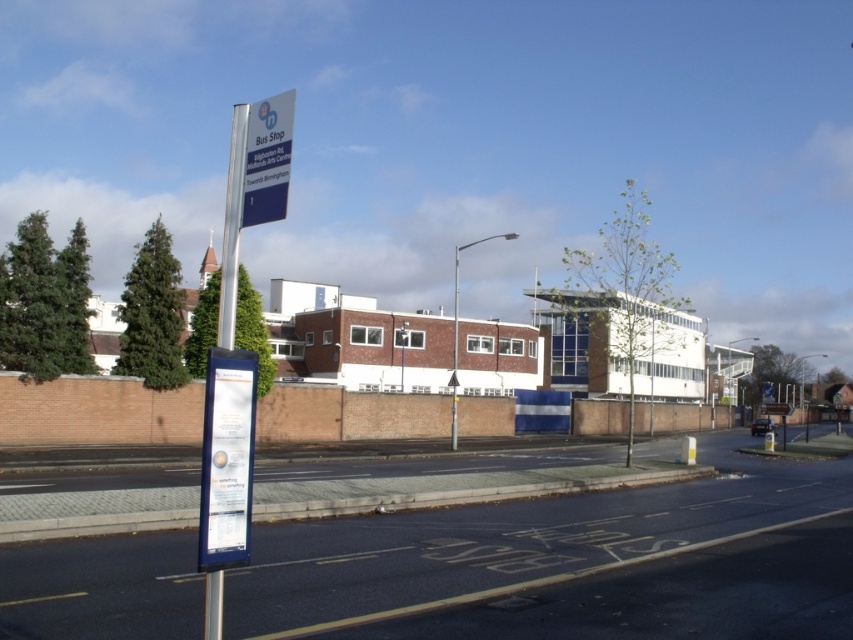
You are waiting at a bus stop and want to check the route details. The blue plastic sign at upper center shows the route number, while the metallic pole at center holds up the sign. Where should you look to see the route number?

The blue plastic sign at upper center is located above the metallic pole at center, so you should look at the blue plastic sign at upper center to see the route number.